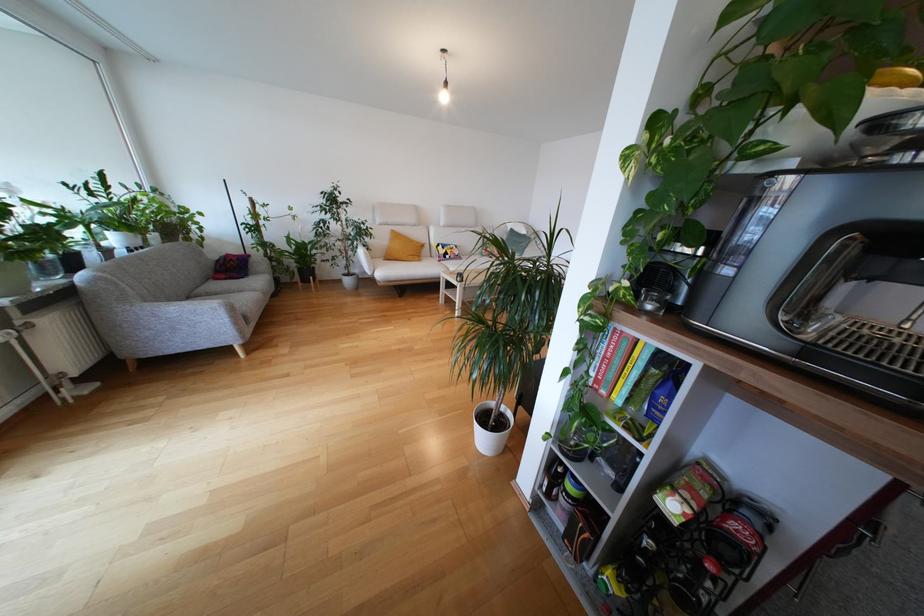
The location [420,243] corresponds to which object?

It corresponds to the yellow pillow in the image.